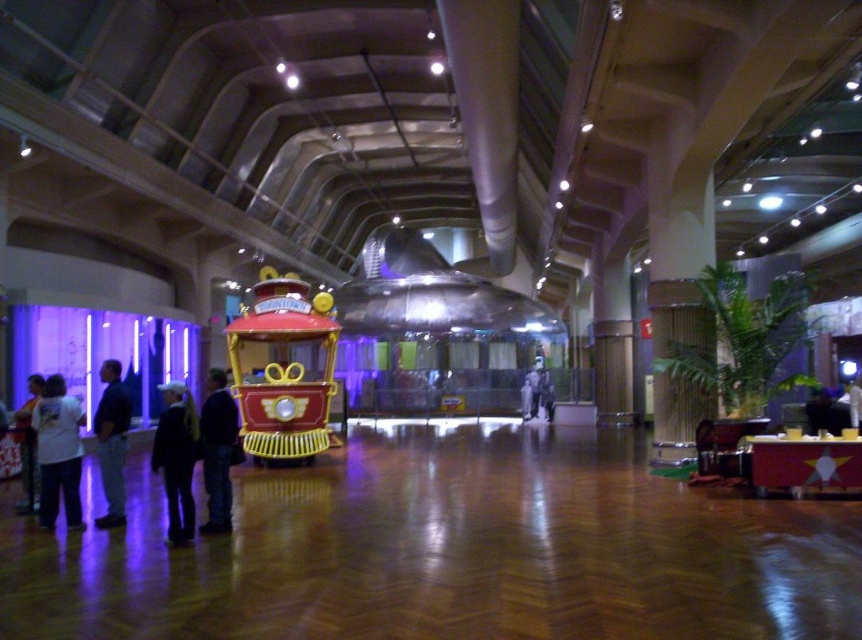
You are standing in the indoor space and want to approach the dark blue fabric jacket at lower left and dark blue jeans at left. Which one should you move toward first to reach the one closer to you?

The dark blue fabric jacket at lower left is closer to the viewer than dark blue jeans at left, so you should move toward the dark blue fabric jacket at lower left first.

You are standing in the middle of the room and want to approach the dark blue fabric jacket at lower left without walking through the shiny red train car at center. Is this possible?

The shiny red train car at center is further to the viewer than the dark blue fabric jacket at lower left, so you can walk around it to reach the jacket without going through the train car.

You are a photographer setting up a tripod in this space. You need to capture a clear shot of both the dark blue fabric jacket at lower left and the dark blue jeans at left. Which object should you position closer to the camera to ensure both are fully visible in the frame?

The dark blue fabric jacket at lower left is shorter than the dark blue jeans at left. To ensure both are fully visible, position the dark blue fabric jacket at lower left closer to the camera so it appears larger in the frame, balancing its size with the taller dark blue jeans at left.